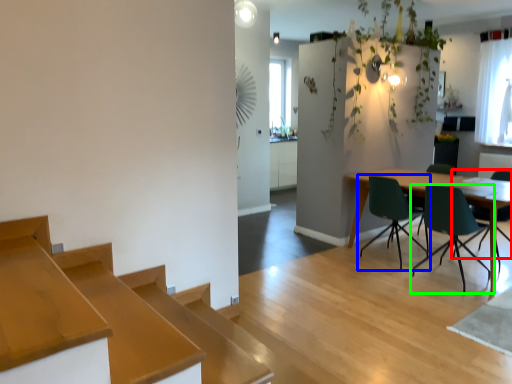
Question: Estimate the real-world distances between objects in this image. Which object is closer to chair (highlighted by a red box), chair (highlighted by a blue box) or chair (highlighted by a green box)?

Choices:
 (A) chair
 (B) chair

Answer: (B)